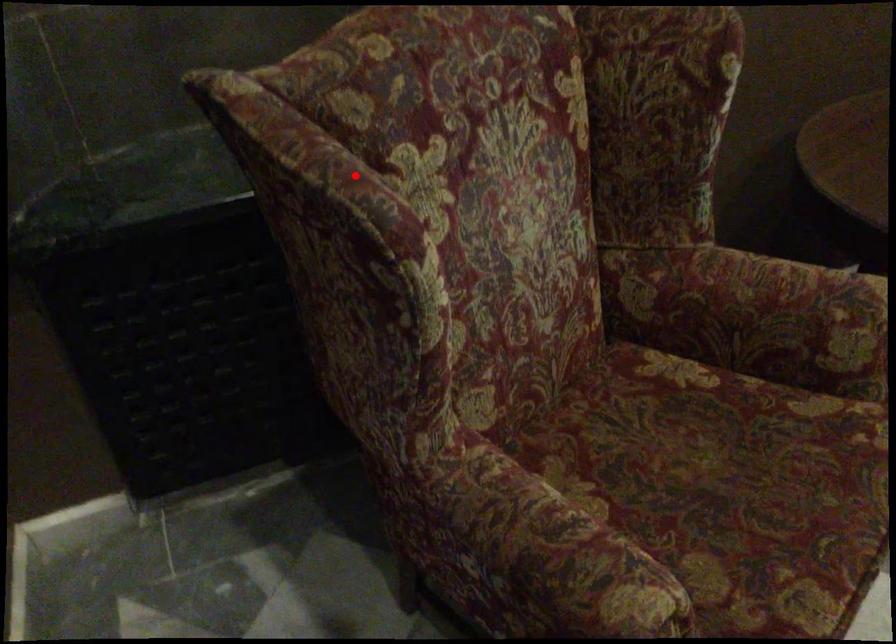
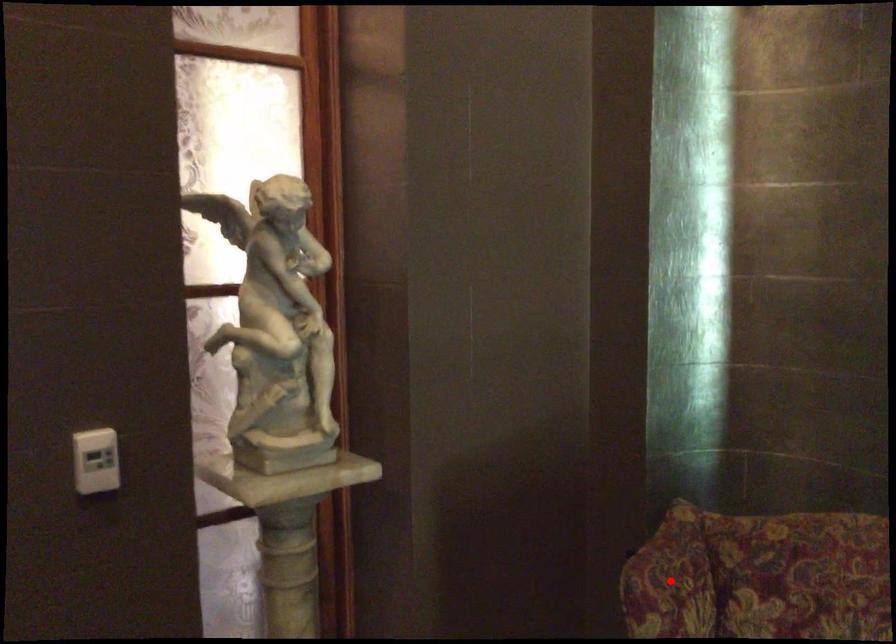
I am providing you with two images of the same scene from different viewpoints. A red point is marked on the first image and another point is marked on the second image. Is the red point in image1 aligned with the point shown in image2?

Yes